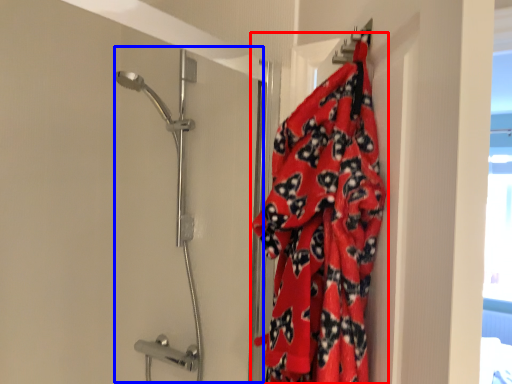
Question: Which of the following is the farthest to the observer, blanket (highlighted by a red box) or shower door (highlighted by a blue box)?

Choices:
 (A) blanket
 (B) shower door

Answer: (B)